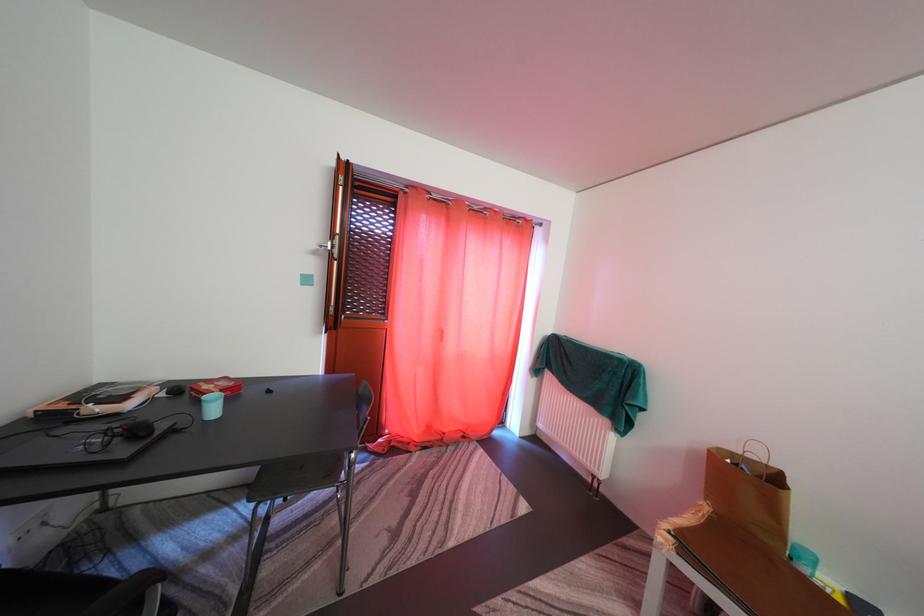
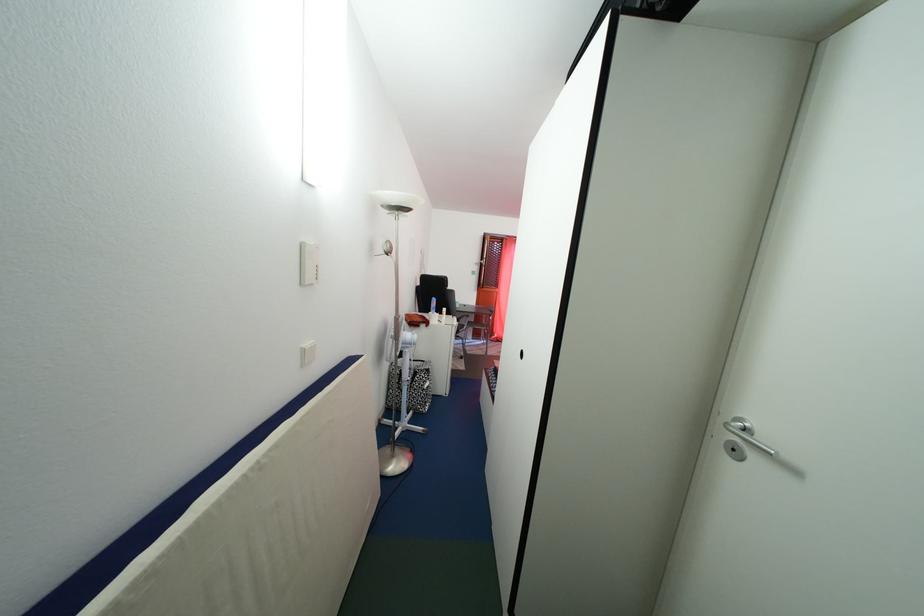
The point at [223,418] is marked in the first image. Where is the corresponding point in the second image?

(466, 313)